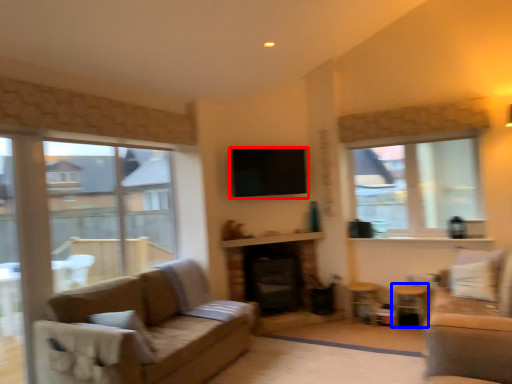
Question: Which object appears closest to the camera in this image, window screen (highlighted by a red box) or side table (highlighted by a blue box)?

Choices:
 (A) window screen
 (B) side table

Answer: (B)